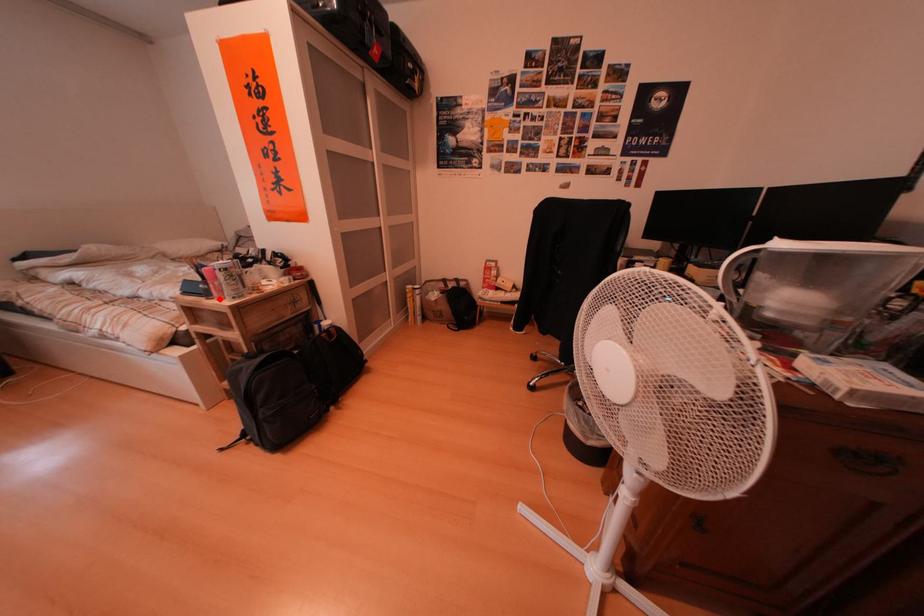
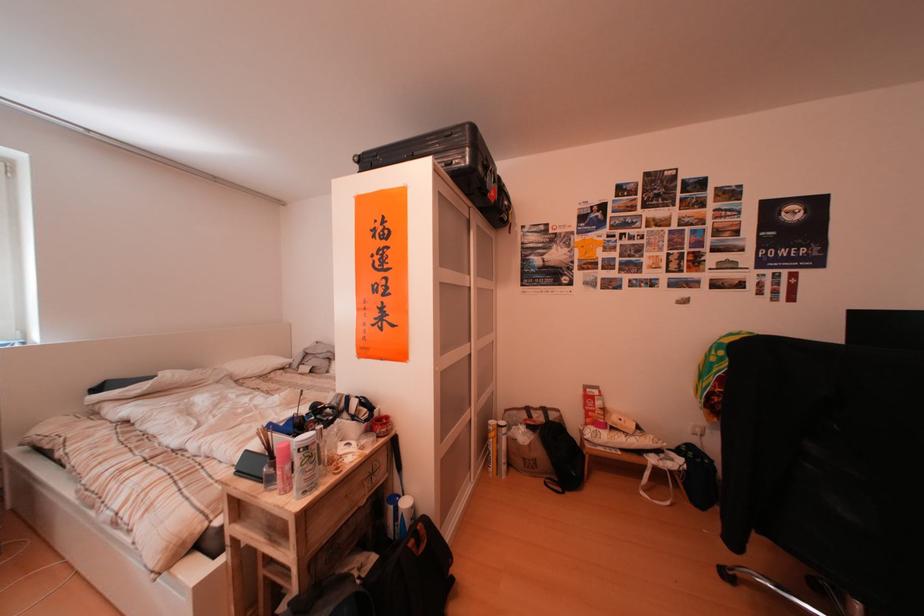
Where in the second image is the point corresponding to the highlighted location from the first image?

(282, 485)